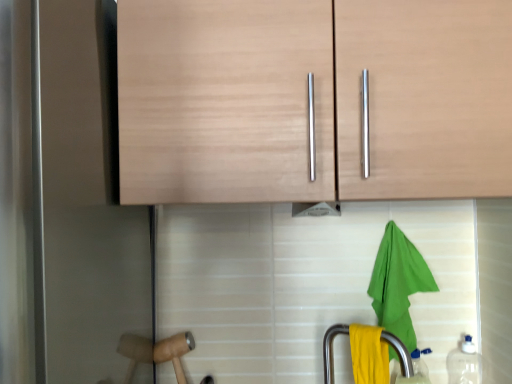
Question: Should I look upward or downward to see green fabric towel at lower right?

Choices:
 (A) up
 (B) down

Answer: (B)

Question: From the image's perspective, is transparent plastic bottle at lower right, the 2th bottle viewed from the left, located above transparent plastic bottle at lower right, the 1th bottle in the left-to-right sequence?

Choices:
 (A) no
 (B) yes

Answer: (B)

Question: Are transparent plastic bottle at lower right, the 2th bottle viewed from the left, and transparent plastic bottle at lower right, the 1th bottle in the left-to-right sequence, located far from each other?

Choices:
 (A) no
 (B) yes

Answer: (A)

Question: Considering the relative positions of transparent plastic bottle at lower right, the 2th bottle viewed from the left, and transparent plastic bottle at lower right, the 1th bottle in the left-to-right sequence, in the image provided, is transparent plastic bottle at lower right, the 2th bottle viewed from the left, to the right of transparent plastic bottle at lower right, the 1th bottle in the left-to-right sequence, from the viewer's perspective?

Choices:
 (A) no
 (B) yes

Answer: (B)

Question: Is transparent plastic bottle at lower right, which is the 1th bottle in right-to-left order, placed right next to transparent plastic bottle at lower right, the 1th bottle in the left-to-right sequence?

Choices:
 (A) no
 (B) yes

Answer: (B)

Question: Can you confirm if transparent plastic bottle at lower right, the 2th bottle viewed from the left, is wider than transparent plastic bottle at lower right, marked as the 2th bottle in a right-to-left arrangement?

Choices:
 (A) no
 (B) yes

Answer: (B)

Question: Is transparent plastic bottle at lower right, which is the 1th bottle in right-to-left order, located outside transparent plastic bottle at lower right, marked as the 2th bottle in a right-to-left arrangement?

Choices:
 (A) no
 (B) yes

Answer: (B)

Question: Considering the relative sizes of green fabric towel at lower right and yellow matte towel at lower center in the image provided, is green fabric towel at lower right taller than yellow matte towel at lower center?

Choices:
 (A) no
 (B) yes

Answer: (B)

Question: Considering the relative sizes of green fabric towel at lower right and yellow matte towel at lower center in the image provided, is green fabric towel at lower right thinner than yellow matte towel at lower center?

Choices:
 (A) no
 (B) yes

Answer: (A)

Question: Does green fabric towel at lower right have a lesser height compared to yellow matte towel at lower center?

Choices:
 (A) no
 (B) yes

Answer: (A)

Question: From the image's perspective, is green fabric towel at lower right on top of yellow matte towel at lower center?

Choices:
 (A) no
 (B) yes

Answer: (B)

Question: Is the depth of green fabric towel at lower right greater than that of yellow matte towel at lower center?

Choices:
 (A) no
 (B) yes

Answer: (B)

Question: Does green fabric towel at lower right appear on the left side of yellow matte towel at lower center?

Choices:
 (A) no
 (B) yes

Answer: (A)

Question: Does green fabric towel at lower right lie behind wooden hammer at lower left?

Choices:
 (A) yes
 (B) no

Answer: (B)